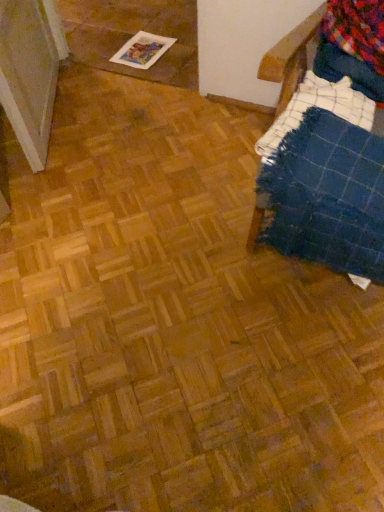
The width and height of the screenshot is (384, 512). Find the location of `vacant region in front of printed paper magazine at upper left`. vacant region in front of printed paper magazine at upper left is located at coordinates (162, 72).